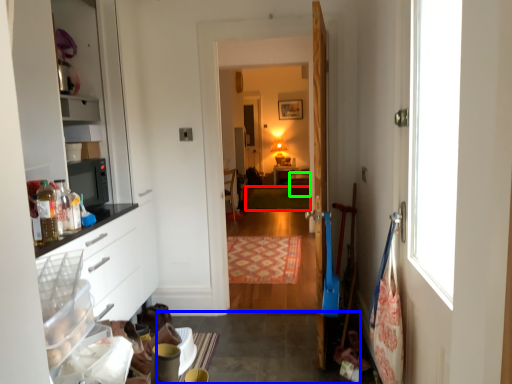
Question: Based on their relative distances, which object is nearer to mat (highlighted by a red box)? Choose from concrete (highlighted by a blue box) and cabinetry (highlighted by a green box).

Choices:
 (A) concrete
 (B) cabinetry

Answer: (B)